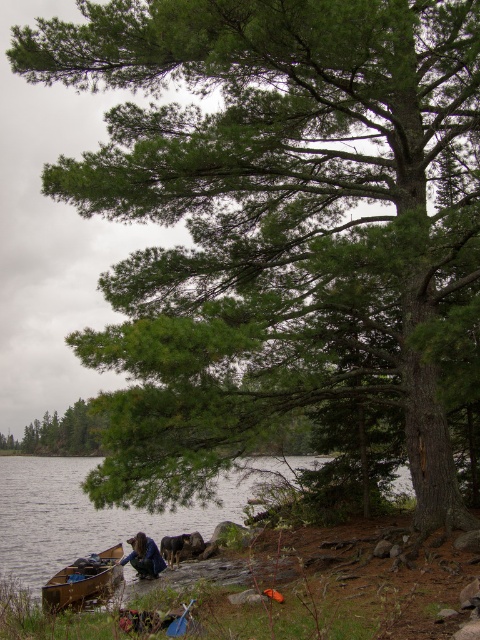
You are standing at the point marked as point (84, 579) in the image. What object is directly in front of you?

The wooden canoe at lower left is directly in front of you at point (84, 579).

You are standing near the lakeside and see the green matte tree at center and the dark blue fabric at lower center. Which object is located to the right of the other?

The green matte tree at center is positioned on the left side of dark blue fabric at lower center, so the dark blue fabric at lower center is to the right of the green matte tree at center.

You are standing at the lakeside and see the wooden canoe at lower left and the dark blue fabric at lower center. Which object is closer to the left side of the scene?

The wooden canoe at lower left is closer to the left side of the scene because it is positioned to the left of the dark blue fabric at lower center.